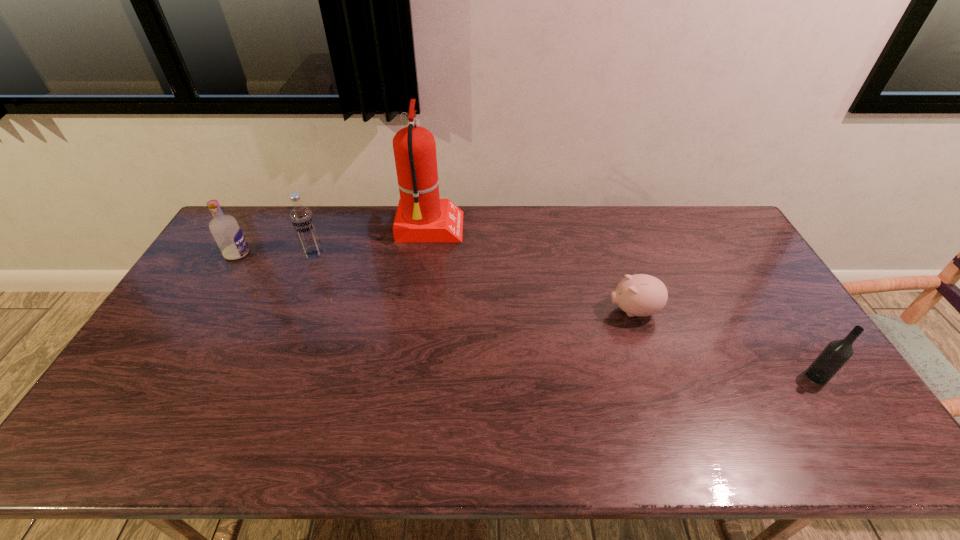
The image size is (960, 540). Identify the location of free space located on the label of the leftmost object. (307, 254).

Where is `vacant space located on the left of the rightmost vodka`? The image size is (960, 540). vacant space located on the left of the rightmost vodka is located at coordinates (743, 376).

Locate an element on the screen. The image size is (960, 540). free space located at the snout of the shortest object is located at coordinates (485, 310).

I want to click on free region located 0.300m at the snout of the shortest object, so click(508, 310).

Image resolution: width=960 pixels, height=540 pixels. What are the coordinates of `vacant space located 0.060m at the snout of the shortest object` in the screenshot? It's located at (588, 310).

Where is `object that is at the far edge`? This screenshot has height=540, width=960. object that is at the far edge is located at coordinates (421, 216).

Find the location of a particular element. This screenshot has width=960, height=540. object positioned at the left edge is located at coordinates (226, 231).

Locate an element on the screen. object that is at the right edge is located at coordinates (837, 353).

Identify the location of vacant space at the far edge of the desktop. Image resolution: width=960 pixels, height=540 pixels. (357, 240).

Locate an element on the screen. The image size is (960, 540). free space at the near edge of the desktop is located at coordinates (508, 428).